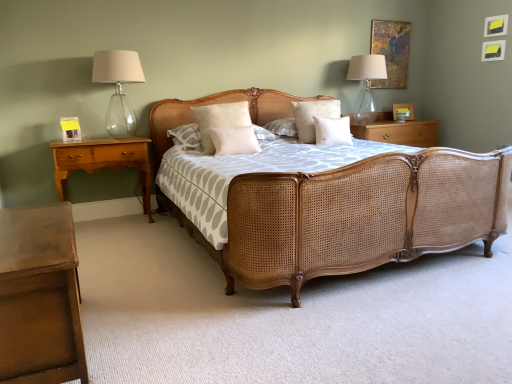
Question: From a real-world perspective, is white soft pillow at center, which is counted as the 3th pillow, starting from the right, under transparent glass lampshade at upper right, which is the 1th bedside lamp from back to front?

Choices:
 (A) yes
 (B) no

Answer: (A)

Question: Is white soft pillow at center, which is counted as the 3th pillow, starting from the right, at the left side of transparent glass lampshade at upper right, which is the 2th bedside lamp from front to back?

Choices:
 (A) no
 (B) yes

Answer: (B)

Question: Considering the relative sizes of white soft pillow at center, which is counted as the 3th pillow, starting from the right, and transparent glass lampshade at upper right, the first bedside lamp positioned from the right, in the image provided, is white soft pillow at center, which is counted as the 3th pillow, starting from the right, taller than transparent glass lampshade at upper right, the first bedside lamp positioned from the right,?

Choices:
 (A) no
 (B) yes

Answer: (A)

Question: Is white soft pillow at center, which is counted as the 3th pillow, starting from the right, beside transparent glass lampshade at upper right, which is the 2th bedside lamp from front to back?

Choices:
 (A) yes
 (B) no

Answer: (B)

Question: Does white soft pillow at center, which is counted as the 3th pillow, starting from the right, have a smaller size compared to transparent glass lampshade at upper right, which is the 2th bedside lamp from front to back?

Choices:
 (A) yes
 (B) no

Answer: (A)

Question: From a real-world perspective, is matte yellow picture frame at left, positioned as the 1th picture frame in bottom-to-top order, positioned above or below beige cotton pillow at center, marked as the 3th pillow in a left-to-right arrangement?

Choices:
 (A) above
 (B) below

Answer: (B)

Question: Relative to beige cotton pillow at center, marked as the 3th pillow in a left-to-right arrangement, is matte yellow picture frame at left, the second picture frame in the right-to-left sequence, in front or behind?

Choices:
 (A) behind
 (B) front

Answer: (B)

Question: Is point (74, 132) closer or farther from the camera than point (304, 125)?

Choices:
 (A) closer
 (B) farther

Answer: (A)

Question: Looking at their shapes, would you say matte yellow picture frame at left, the second picture frame in the right-to-left sequence, is wider or thinner than beige cotton pillow at center, marked as the 3th pillow in a left-to-right arrangement?

Choices:
 (A) thin
 (B) wide

Answer: (A)

Question: Is point (121, 99) positioned closer to the camera than point (337, 122)?

Choices:
 (A) farther
 (B) closer

Answer: (B)

Question: From a real-world perspective, is clear glass lampshade at left, which ranks as the 1th bedside lamp in front-to-back order, above or below white cotton pillow at center, which is counted as the fourth pillow, starting from the left?

Choices:
 (A) above
 (B) below

Answer: (A)

Question: Is clear glass lampshade at left, marked as the second bedside lamp in a right-to-left arrangement, wider or thinner than white cotton pillow at center, the 1th pillow in the right-to-left sequence?

Choices:
 (A) thin
 (B) wide

Answer: (B)

Question: Is clear glass lampshade at left, arranged as the 2th bedside lamp when viewed from the back, in front of or behind white cotton pillow at center, which is counted as the fourth pillow, starting from the left, in the image?

Choices:
 (A) front
 (B) behind

Answer: (A)

Question: Considering the positions of point tap(371, 21) and point tap(355, 102), is point tap(371, 21) closer or farther from the camera than point tap(355, 102)?

Choices:
 (A) closer
 (B) farther

Answer: (A)

Question: From a real-world perspective, is wooden picture frame at upper right, the 2th picture frame viewed from the left, above or below transparent glass lampshade at upper right, which is the 2th bedside lamp from front to back?

Choices:
 (A) below
 (B) above

Answer: (B)